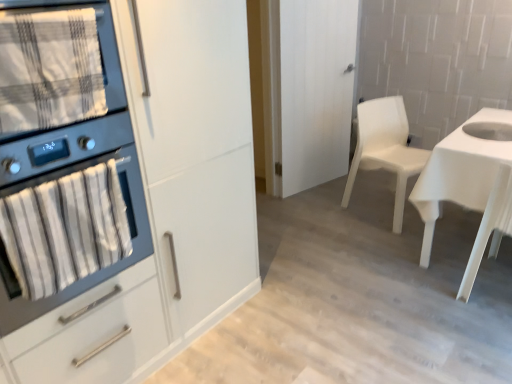
Question: Is white glossy desk at right situated inside plaid fabric towel at left or outside?

Choices:
 (A) outside
 (B) inside

Answer: (A)

Question: Is point (488, 153) closer or farther from the camera than point (1, 62)?

Choices:
 (A) farther
 (B) closer

Answer: (A)

Question: Estimate the real-world distances between objects in this image. Which object is closer to the white glossy sink at right?

Choices:
 (A) matte black oven at left
 (B) plaid fabric towel at left
 (C) white plastic chair at center-right
 (D) white matte cabinet at left
 (E) white matte door at center

Answer: (C)

Question: Considering the real-world distances, which object is closest to the matte black oven at left?

Choices:
 (A) white matte cabinet at left
 (B) white matte door at center
 (C) white glossy desk at right
 (D) plaid fabric towel at left
 (E) white glossy sink at right

Answer: (A)